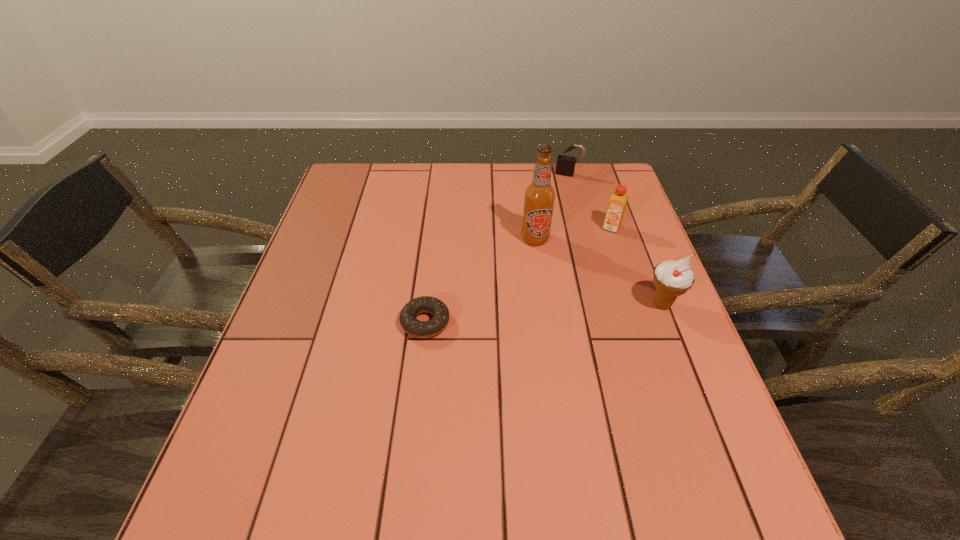
Find the location of a particular element. doughnut is located at coordinates (426, 304).

I want to click on the leftmost object, so click(x=426, y=304).

The width and height of the screenshot is (960, 540). I want to click on icecream, so click(671, 278).

Where is `the third tallest object`? The height and width of the screenshot is (540, 960). the third tallest object is located at coordinates (617, 203).

Identify the location of the second shortest object. (565, 164).

The image size is (960, 540). I want to click on padlock, so click(x=565, y=164).

At what (x,y) coordinates should I click in order to perform the action: click on the fourth object from right to left. Please return your answer as a coordinate pair (x, y). This screenshot has width=960, height=540. Looking at the image, I should click on (539, 196).

The width and height of the screenshot is (960, 540). In order to click on beer bottle in this screenshot , I will do `click(539, 196)`.

Find the location of `vacant space located on the front of the shortest object`. vacant space located on the front of the shortest object is located at coordinates (412, 444).

At what (x,y) coordinates should I click in order to perform the action: click on vacant space located 0.310m on the front of the icecream. Please return your answer as a coordinate pair (x, y). The image size is (960, 540). Looking at the image, I should click on (719, 450).